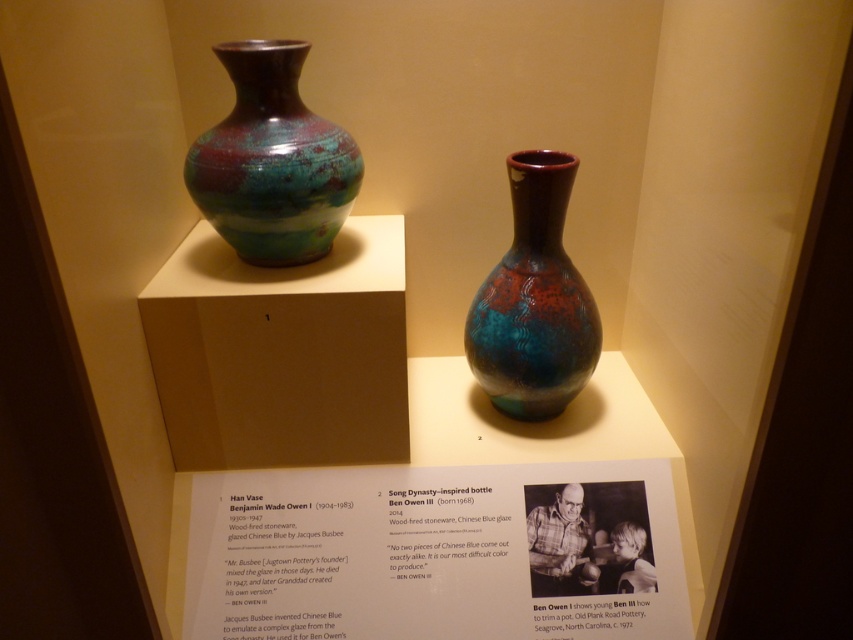
You are standing in front of two ceramic vases displayed in a museum. You notice two specific points marked on the vases. The first point is at coordinates point [321,131] and the second is at point [471,364]. Which of these points is closer to you?

Point [321,131] is closer to the viewer than point [471,364].

You are an art curator planning to install a new spotlight in the gallery. The spotlight needs to be placed directly above the matte glazed vase at center. Given the gallery ceiling grid coordinates, what are the coordinates where you should position the spotlight?

The matte glazed vase at center is located at point (271, 161), so the spotlight should be positioned directly above these coordinates to illuminate it properly.